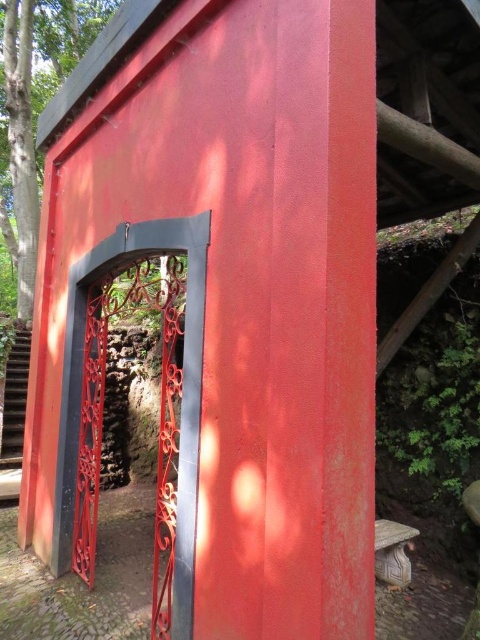
Question: Which is farther from the carved stone stool at lower right?

Choices:
 (A) green leafy tree at upper left
 (B) wrought iron gate at center

Answer: (A)

Question: Which point is closer to the camera?

Choices:
 (A) green leafy tree at upper left
 (B) carved stone stool at lower right

Answer: (B)

Question: Which object is positioned farthest from the wrought iron gate at center?

Choices:
 (A) green leafy tree at upper left
 (B) carved stone stool at lower right

Answer: (A)

Question: Does wrought iron gate at center have a greater width compared to green leafy tree at upper left?

Choices:
 (A) yes
 (B) no

Answer: (B)

Question: Considering the relative positions of wrought iron gate at center and green leafy tree at upper left in the image provided, where is wrought iron gate at center located with respect to green leafy tree at upper left?

Choices:
 (A) below
 (B) above

Answer: (A)

Question: Is green leafy tree at upper left above carved stone stool at lower right?

Choices:
 (A) yes
 (B) no

Answer: (A)